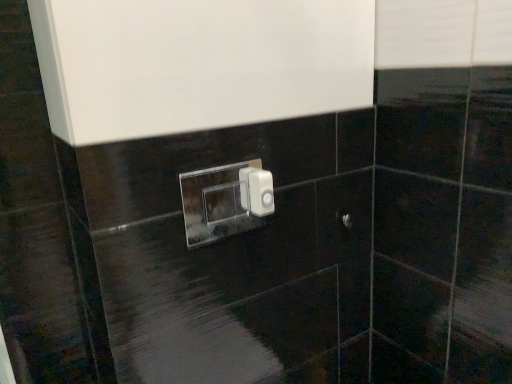
Question: Is transparent acrylic light switch at center, the first light switch in the left-to-right sequence, bigger than white plastic light switch at center, arranged as the first light switch when viewed from the right?

Choices:
 (A) no
 (B) yes

Answer: (B)

Question: From a real-world perspective, is transparent acrylic light switch at center, which is the 2th light switch from right to left, located beneath white plastic light switch at center, arranged as the first light switch when viewed from the right?

Choices:
 (A) yes
 (B) no

Answer: (A)

Question: Is transparent acrylic light switch at center, which is the 2th light switch from right to left, not near white plastic light switch at center, arranged as the first light switch when viewed from the right?

Choices:
 (A) yes
 (B) no

Answer: (A)

Question: Is transparent acrylic light switch at center, which is the 2th light switch from right to left, shorter than white plastic light switch at center, which ranks as the 2th light switch in left-to-right order?

Choices:
 (A) no
 (B) yes

Answer: (A)

Question: Is transparent acrylic light switch at center, which is the 2th light switch from right to left, next to white plastic light switch at center, which ranks as the 2th light switch in left-to-right order, and touching it?

Choices:
 (A) no
 (B) yes

Answer: (A)

Question: From a real-world perspective, is white plastic light switch at center, which ranks as the 2th light switch in left-to-right order, above or below transparent acrylic light switch at center, the first light switch in the left-to-right sequence?

Choices:
 (A) above
 (B) below

Answer: (A)

Question: Looking at the image, does white plastic light switch at center, which ranks as the 2th light switch in left-to-right order, seem bigger or smaller compared to transparent acrylic light switch at center, which is the 2th light switch from right to left?

Choices:
 (A) big
 (B) small

Answer: (B)

Question: From the image's perspective, is white plastic light switch at center, arranged as the first light switch when viewed from the right, located above or below transparent acrylic light switch at center, the first light switch in the left-to-right sequence?

Choices:
 (A) below
 (B) above

Answer: (B)

Question: Is white plastic light switch at center, arranged as the first light switch when viewed from the right, wider or thinner than transparent acrylic light switch at center, which is the 2th light switch from right to left?

Choices:
 (A) thin
 (B) wide

Answer: (B)

Question: From a real-world perspective, is satin nickel door handle at center physically located above or below white plastic light switch at center, which ranks as the 2th light switch in left-to-right order?

Choices:
 (A) above
 (B) below

Answer: (B)

Question: From the image's perspective, is satin nickel door handle at center located above or below white plastic light switch at center, which ranks as the 2th light switch in left-to-right order?

Choices:
 (A) below
 (B) above

Answer: (A)

Question: Does point (336, 221) appear closer or farther from the camera than point (261, 210)?

Choices:
 (A) closer
 (B) farther

Answer: (B)

Question: Is satin nickel door handle at center in front of or behind white plastic light switch at center, arranged as the first light switch when viewed from the right, in the image?

Choices:
 (A) behind
 (B) front

Answer: (A)

Question: From a real-world perspective, relative to transparent acrylic light switch at center, which is the 2th light switch from right to left, is satin nickel door handle at center vertically above or below?

Choices:
 (A) below
 (B) above

Answer: (A)

Question: Is satin nickel door handle at center taller or shorter than transparent acrylic light switch at center, which is the 2th light switch from right to left?

Choices:
 (A) short
 (B) tall

Answer: (A)